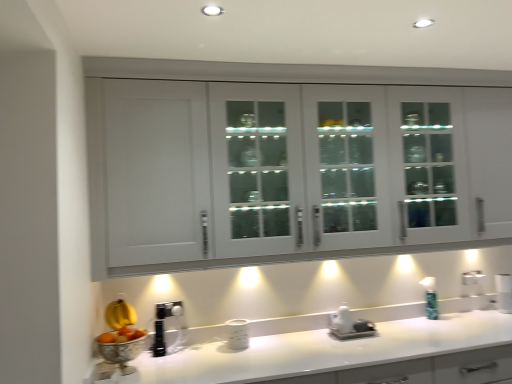
Question: Would you say green glass soap dispenser at right is to the left or to the right of white glossy countertop at lower center in the picture?

Choices:
 (A) right
 (B) left

Answer: (A)

Question: From a real-world perspective, relative to white glossy countertop at lower center, is green glass soap dispenser at right vertically above or below?

Choices:
 (A) below
 (B) above

Answer: (B)

Question: Estimate the real-world distances between objects in this image. Which object is farther from the green glass soap dispenser at right?

Choices:
 (A) white glossy cabinet at upper center
 (B) white glossy countertop at lower center

Answer: (A)

Question: Which of these objects is positioned farthest from the green glass soap dispenser at right?

Choices:
 (A) white glossy countertop at lower center
 (B) white glossy cabinet at upper center

Answer: (B)